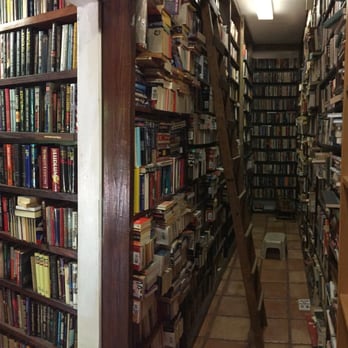
Image resolution: width=348 pixels, height=348 pixels. What are the coordinates of `ceiling` in the screenshot? It's located at (278, 30).